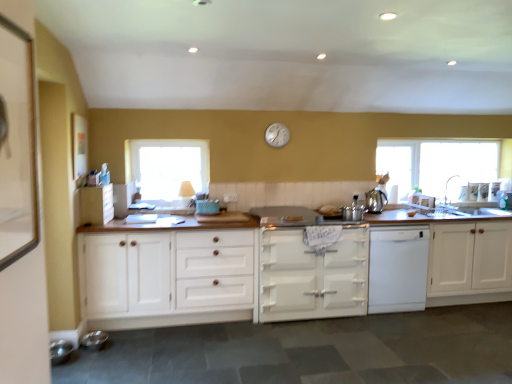
Identify the location of free spot to the right of metallic stainless steel bowls at lower left, placed as the 1th appliance when sorted from bottom to top. The height and width of the screenshot is (384, 512). (79, 359).